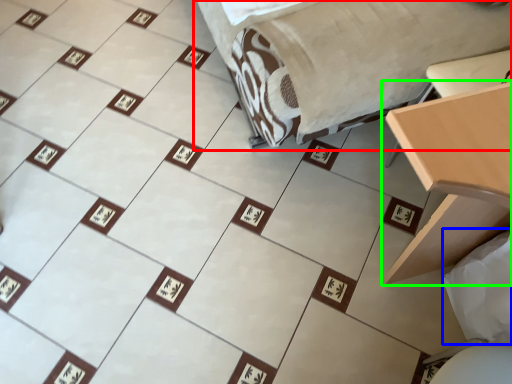
Question: Estimate the real-world distances between objects in this image. Which object is closer to furniture (highlighted by a red box), sheet (highlighted by a blue box) or table (highlighted by a green box)?

Choices:
 (A) sheet
 (B) table

Answer: (B)